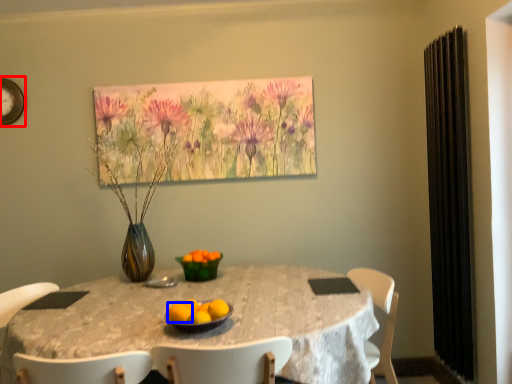
Question: Which of the following is the farthest to the observer, clock (highlighted by a red box) or orange (highlighted by a blue box)?

Choices:
 (A) clock
 (B) orange

Answer: (A)